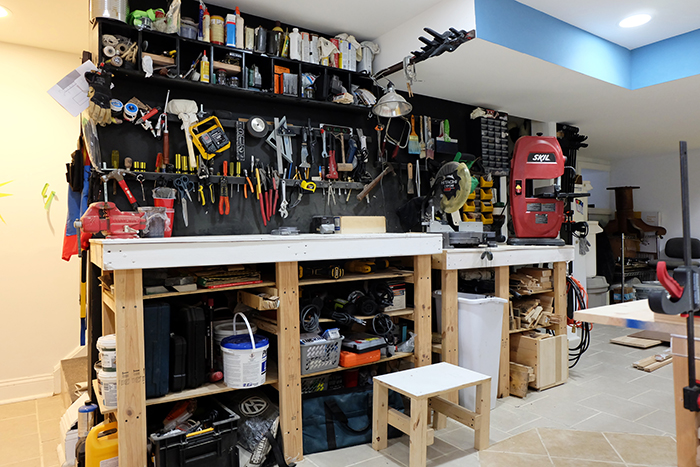
The width and height of the screenshot is (700, 467). What are the coordinates of `stool` in the screenshot? It's located at (437, 414).